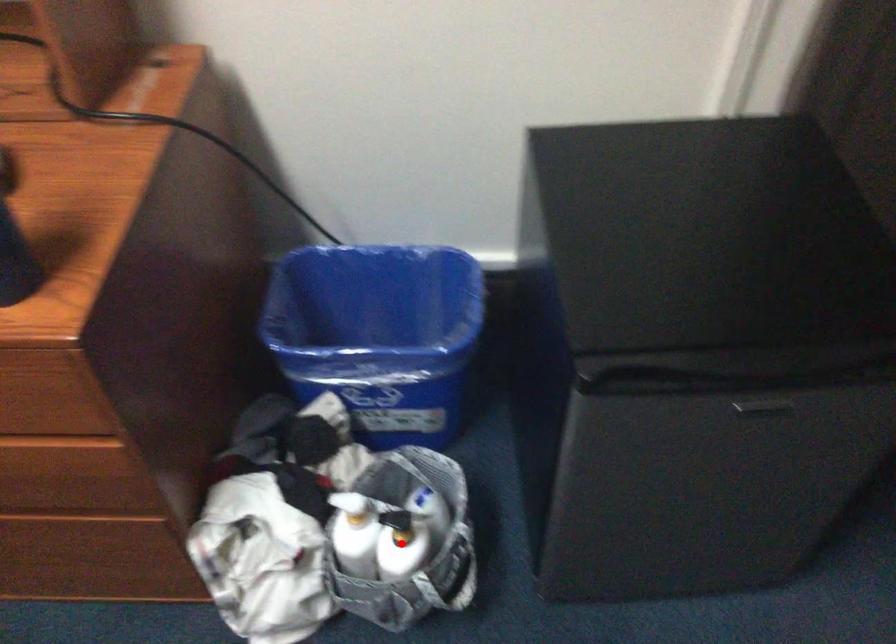
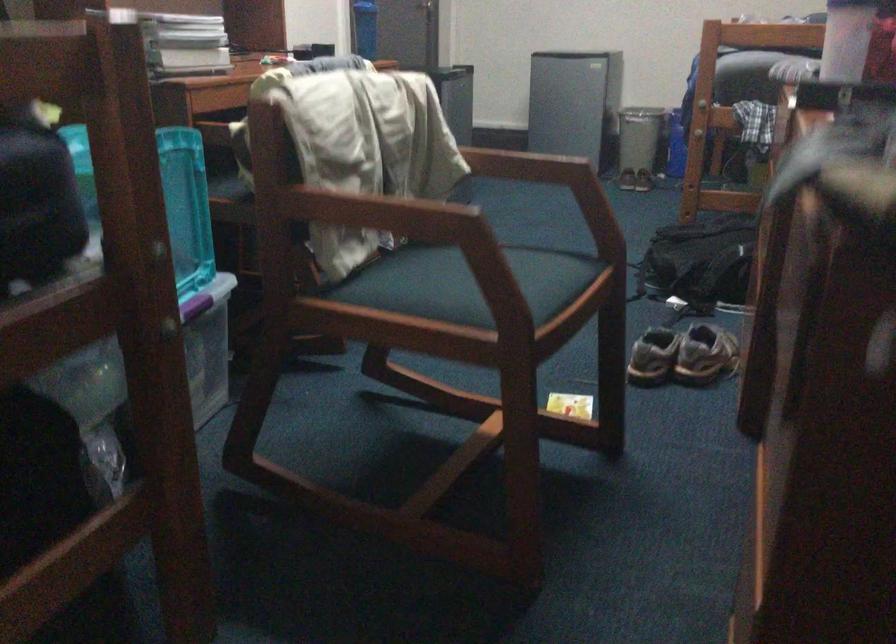
Question: I am providing you with two images of the same scene from different viewpoints. A red point is marked on the first image. At the location where the point appears in image 1, is it still visible in image 2?

Choices:
 (A) Yes
 (B) No

Answer: (B)